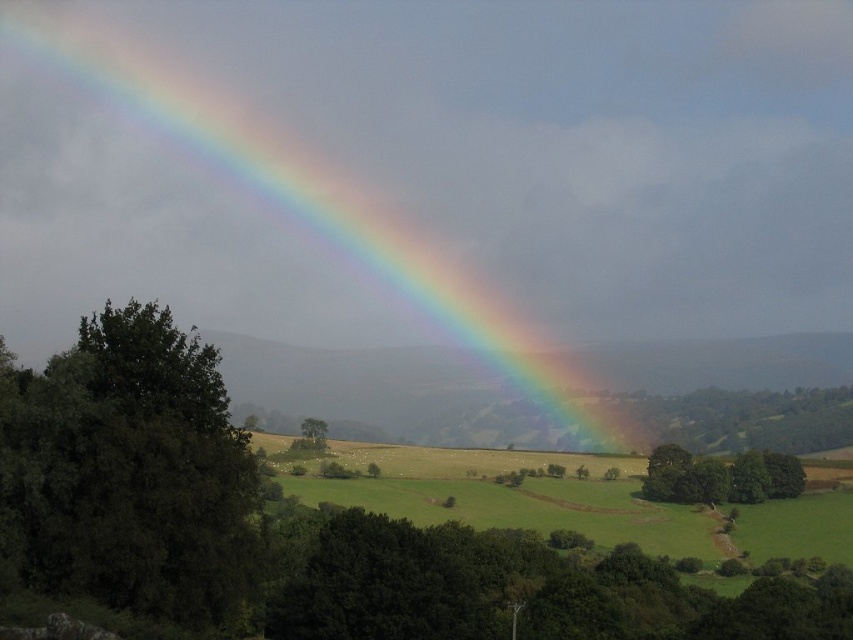
Question: Can you confirm if green leafy tree at lower center is wider than green leafy trees at lower right?

Choices:
 (A) yes
 (B) no

Answer: (A)

Question: Does rainbow at upper left appear on the right side of green grassy field at center?

Choices:
 (A) no
 (B) yes

Answer: (A)

Question: Among these objects, which one is nearest to the camera?

Choices:
 (A) green leafy trees at lower right
 (B) green grassy field at center
 (C) green leafy tree at lower center
 (D) green leafy tree at center

Answer: (C)

Question: Which object appears farthest from the camera in this image?

Choices:
 (A) green leafy tree at center
 (B) rainbow at upper left
 (C) green leafy tree at lower center

Answer: (B)

Question: Can you confirm if green leafy tree at lower center is positioned below green leafy trees at lower right?

Choices:
 (A) no
 (B) yes

Answer: (A)

Question: Which is nearer to the green grassy field at center?

Choices:
 (A) green leafy trees at lower right
 (B) green leafy tree at center
 (C) dark green leafy tree at left

Answer: (A)